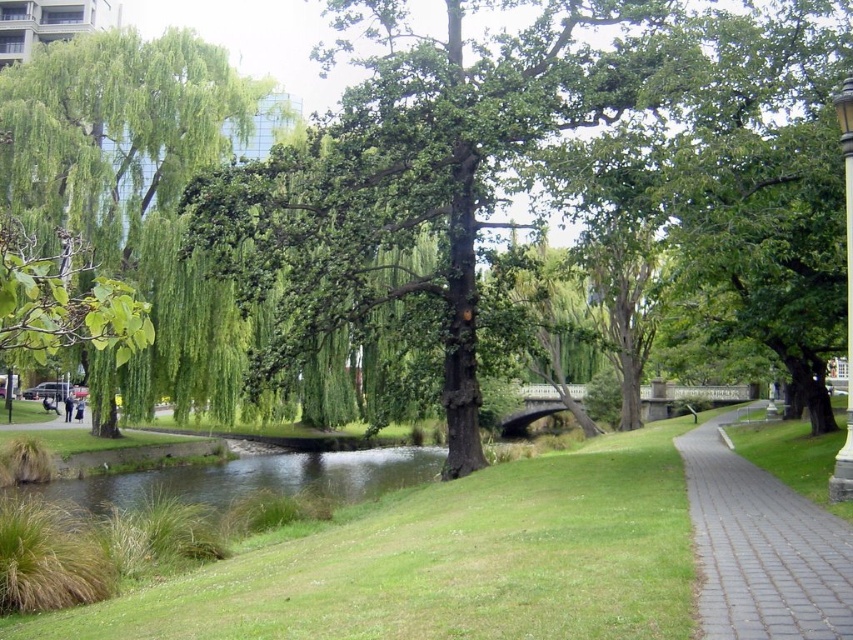
Question: Does green leafy willow at upper left appear on the left side of paved brick path at lower right?

Choices:
 (A) yes
 (B) no

Answer: (A)

Question: Which object appears farthest from the camera in this image?

Choices:
 (A) green leafy willow at upper left
 (B) paved brick path at lower right

Answer: (A)

Question: Does green leafy willow at upper left come behind paved brick path at lower right?

Choices:
 (A) yes
 (B) no

Answer: (A)

Question: Is green leafy willow at upper left positioned in front of paved brick path at lower right?

Choices:
 (A) yes
 (B) no

Answer: (B)

Question: Which point is closer to the camera?

Choices:
 (A) green leafy willow at upper left
 (B) paved brick path at lower right

Answer: (B)